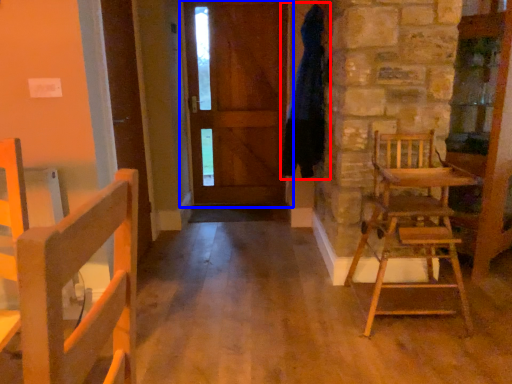
Question: Which of the following is the closest to the observer, bathrobe (highlighted by a red box) or door (highlighted by a blue box)?

Choices:
 (A) bathrobe
 (B) door

Answer: (A)